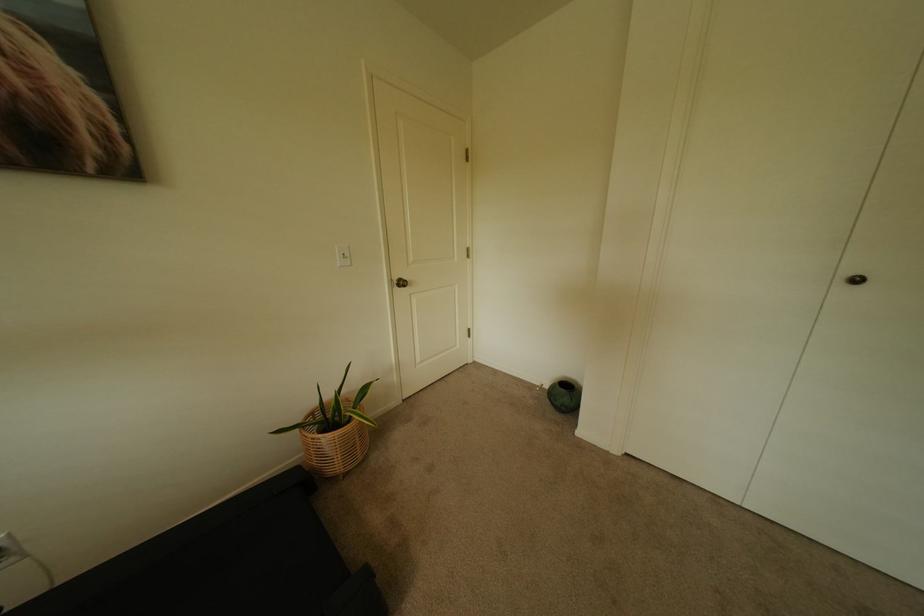
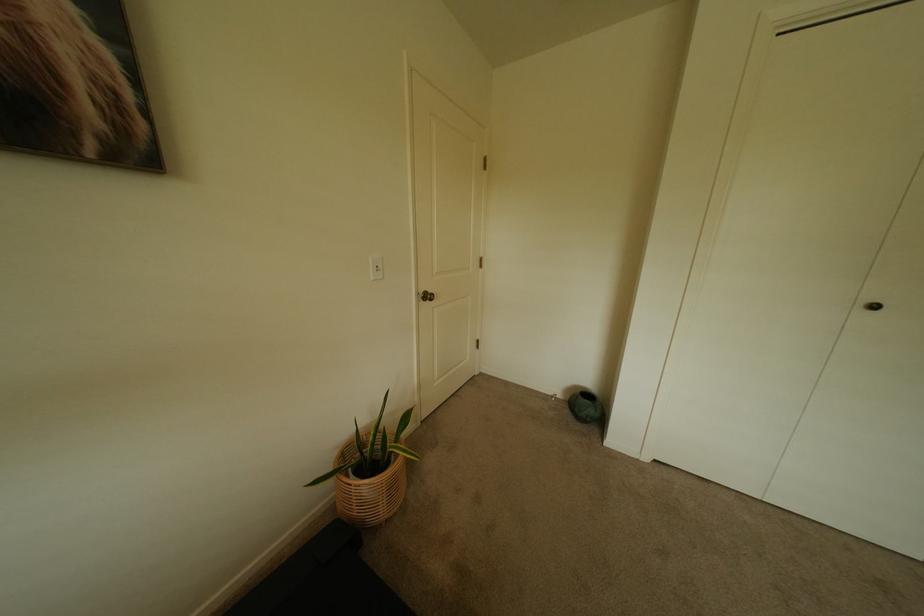
Question: The camera is either moving clockwise (left) or counter-clockwise (right) around the object. The first image is from the beginning of the video and the second image is from the end. Is the camera moving left or right when shooting the video?

Choices:
 (A) Left
 (B) Right

Answer: (A)